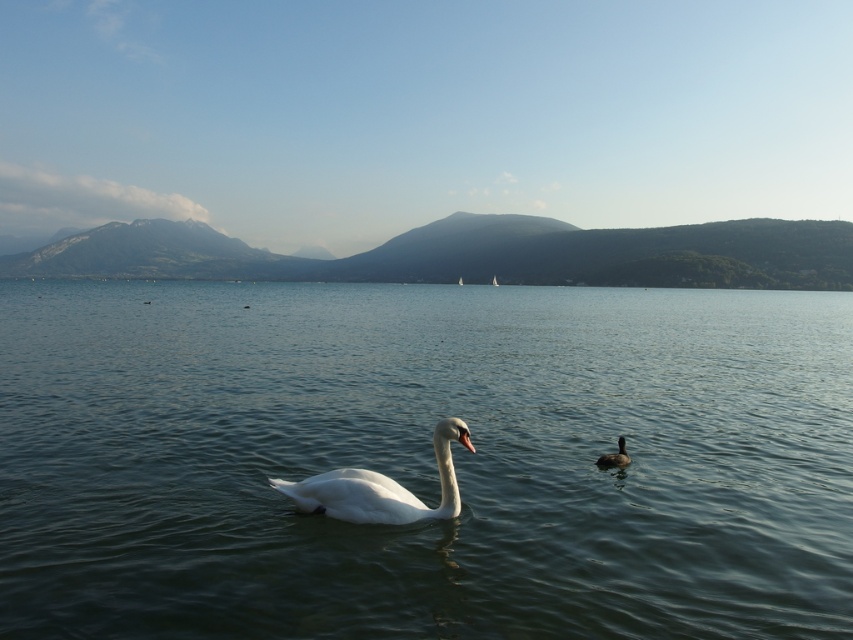
You are an ornithologist observing the lake. You notice the white glossy swan at center and the dark brown glossy duck at right. Which bird has a larger body size?

The white glossy swan at center is bigger than the dark brown glossy duck at right, so the swan has a larger body size.

You are a photographer standing on the lakeside shore. You want to take a photo that includes both the clear water at center and the dark brown glossy duck at right. Given that your camera has a maximum focus range of 50 meters, will you be able to capture both subjects in focus without moving your position?

The distance between the clear water at center and the dark brown glossy duck at right is 46.44 meters, which is within the camera maximum focus range of 50 meters. Therefore, you can capture both subjects in focus without moving your position.